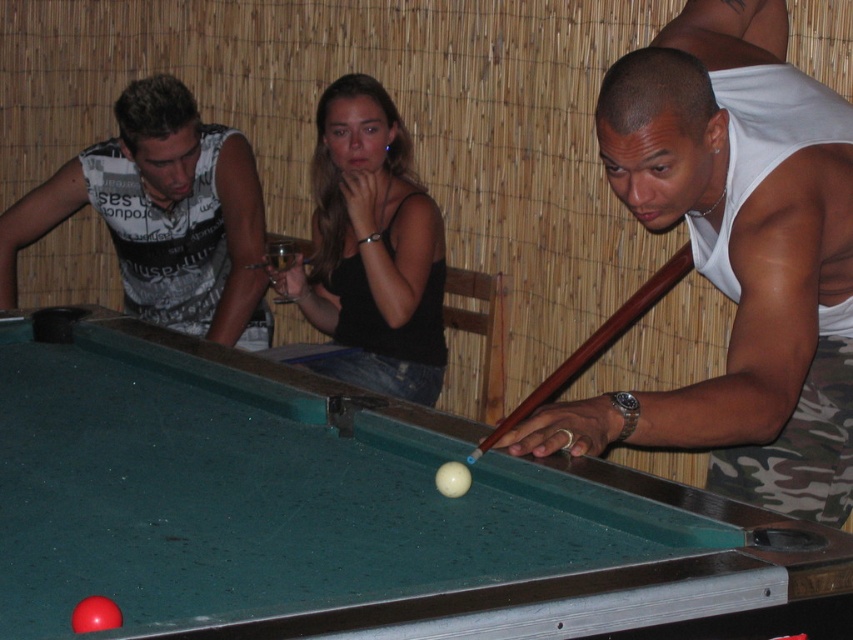
You are a photographer trying to capture a closeup of the white printed tank top at left and the brown wood pool cue at center. Since you want to focus on both objects equally, which one should you adjust your camera lens to prioritize in terms of size in the frame?

The white printed tank top at left is bigger than the brown wood pool cue at center, so you should adjust your camera lens to prioritize focusing on the white printed tank top at left to ensure both appear equally sized in the frame.

You are a photographer standing near the camera. You want to take a photo of the white printed tank top at left. Can you reach it with your camera without moving? The camera has a zoom lens with a maximum zoom of 2 meters.

The white printed tank top at left and camera are 3.26 meters apart. Since the camera can only zoom up to 2 meters, you cannot reach the white printed tank top at left without moving closer.